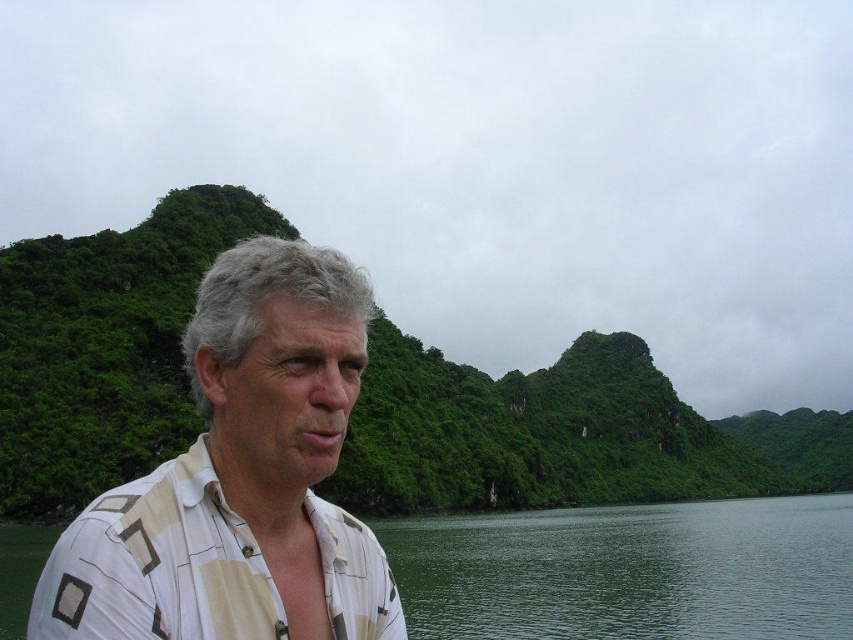
Question: Which of the following is the farthest from the observer?

Choices:
 (A) green water at lower left
 (B) white striped shirt at center

Answer: (A)

Question: Does white striped shirt at center have a lesser width compared to green water at lower left?

Choices:
 (A) no
 (B) yes

Answer: (B)

Question: Does white striped shirt at center have a lesser width compared to green water at lower left?

Choices:
 (A) yes
 (B) no

Answer: (A)

Question: Which point appears closest to the camera in this image?

Choices:
 (A) (497, 547)
 (B) (341, 392)

Answer: (B)

Question: Is white striped shirt at center bigger than green water at lower left?

Choices:
 (A) yes
 (B) no

Answer: (B)

Question: Which point is farther from the camera taking this photo?

Choices:
 (A) (486, 592)
 (B) (141, 522)

Answer: (A)